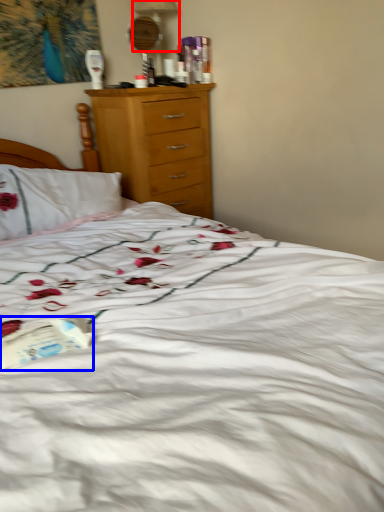
Question: Which object appears closest to the camera in this image, table lamp (highlighted by a red box) or paperback book (highlighted by a blue box)?

Choices:
 (A) table lamp
 (B) paperback book

Answer: (B)